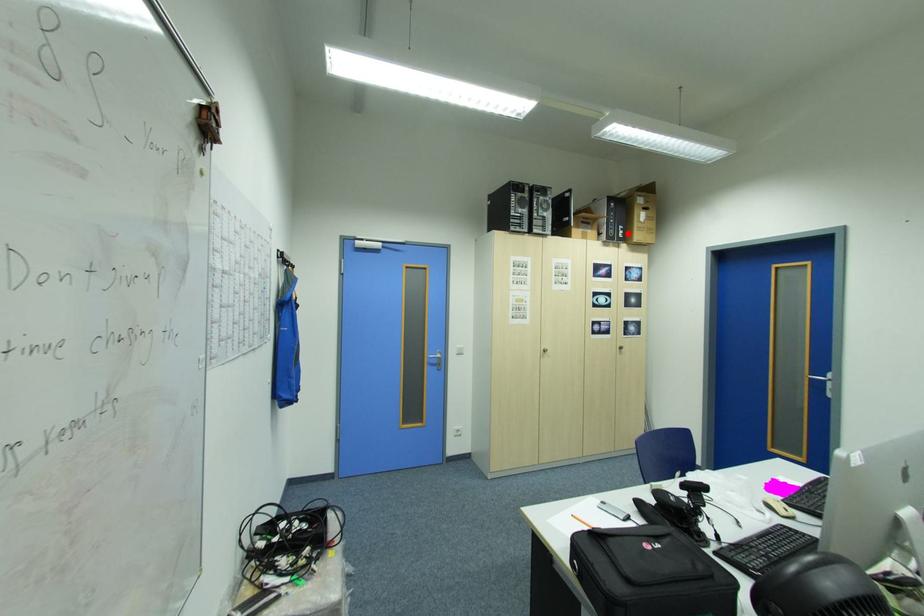
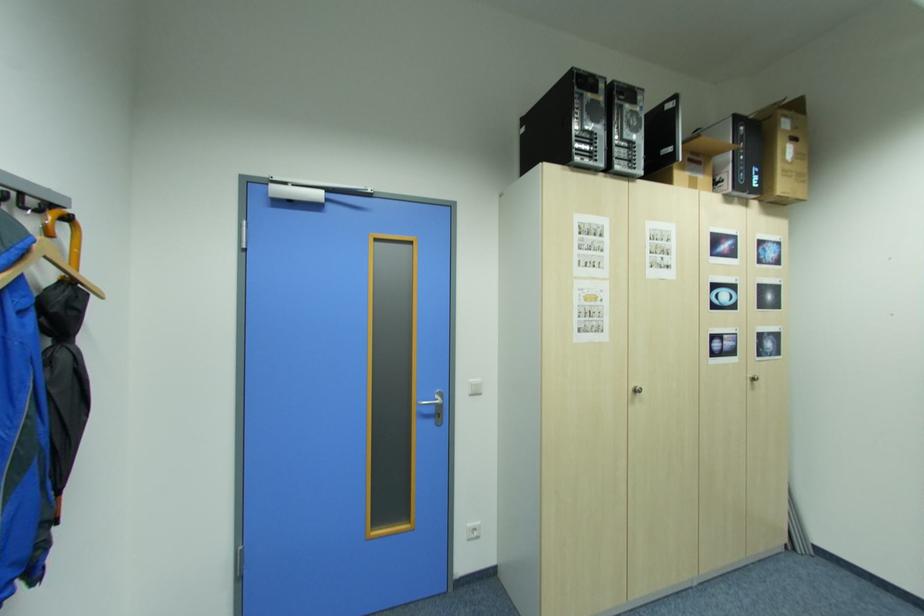
Locate, in the second image, the point that corresponds to the highlighted location in the first image.

(762, 179)